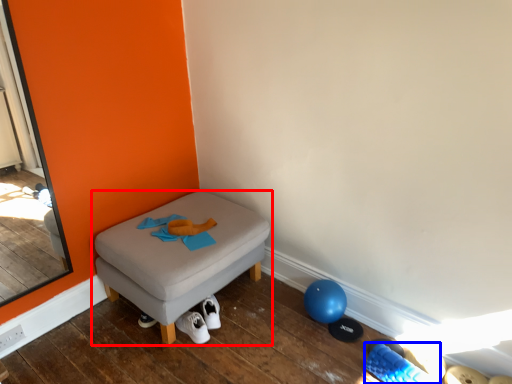
Question: Which object is closer to the camera taking this photo, furniture (highlighted by a red box) or footwear (highlighted by a blue box)?

Choices:
 (A) furniture
 (B) footwear

Answer: (B)